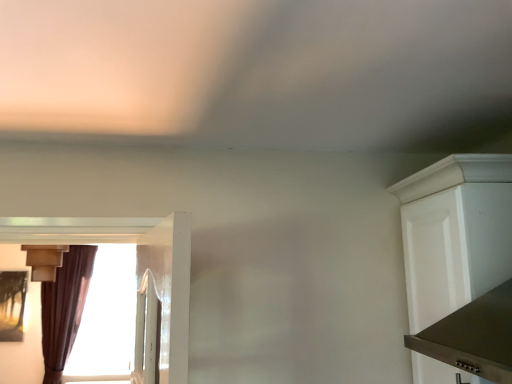
Question: Is brown velvet curtain at left further to camera compared to matte beige light fixture at left?

Choices:
 (A) no
 (B) yes

Answer: (B)

Question: Is brown velvet curtain at left beside matte beige light fixture at left?

Choices:
 (A) no
 (B) yes

Answer: (A)

Question: Would you consider brown velvet curtain at left to be distant from matte beige light fixture at left?

Choices:
 (A) no
 (B) yes

Answer: (A)

Question: Is brown velvet curtain at left outside matte beige light fixture at left?

Choices:
 (A) yes
 (B) no

Answer: (A)

Question: Can you confirm if brown velvet curtain at left is taller than matte beige light fixture at left?

Choices:
 (A) yes
 (B) no

Answer: (A)

Question: Choose the correct answer: Is brown velvet curtain at left inside matte beige light fixture at left or outside it?

Choices:
 (A) inside
 (B) outside

Answer: (B)

Question: Is point (56, 374) positioned closer to the camera than point (28, 246)?

Choices:
 (A) closer
 (B) farther

Answer: (B)

Question: Is brown velvet curtain at left to the left or to the right of matte beige light fixture at left in the image?

Choices:
 (A) right
 (B) left

Answer: (B)

Question: From their relative heights in the image, would you say brown velvet curtain at left is taller or shorter than matte beige light fixture at left?

Choices:
 (A) tall
 (B) short

Answer: (A)

Question: Do you think matte beige light fixture at left is within white matte cabinet at right, or outside of it?

Choices:
 (A) inside
 (B) outside

Answer: (B)

Question: Is point (34, 256) closer or farther from the camera than point (504, 228)?

Choices:
 (A) closer
 (B) farther

Answer: (B)

Question: From a real-world perspective, is matte beige light fixture at left positioned above or below white matte cabinet at right?

Choices:
 (A) below
 (B) above

Answer: (B)

Question: From their relative heights in the image, would you say matte beige light fixture at left is taller or shorter than white matte cabinet at right?

Choices:
 (A) tall
 (B) short

Answer: (B)

Question: Relative to matte beige light fixture at left, is white matte cabinet at right in front or behind?

Choices:
 (A) behind
 (B) front

Answer: (B)

Question: Considering the positions of white matte cabinet at right and matte beige light fixture at left in the image, is white matte cabinet at right taller or shorter than matte beige light fixture at left?

Choices:
 (A) tall
 (B) short

Answer: (A)